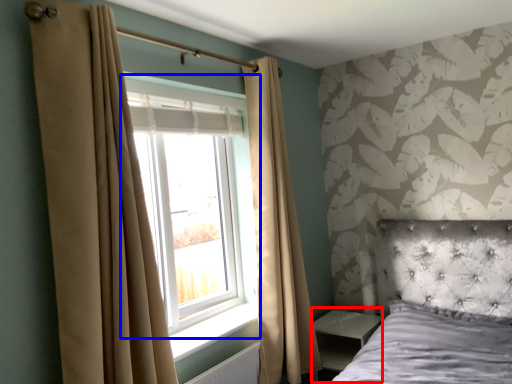
Question: Among these objects, which one is farthest to the camera, side table (highlighted by a red box) or window (highlighted by a blue box)?

Choices:
 (A) side table
 (B) window

Answer: (A)